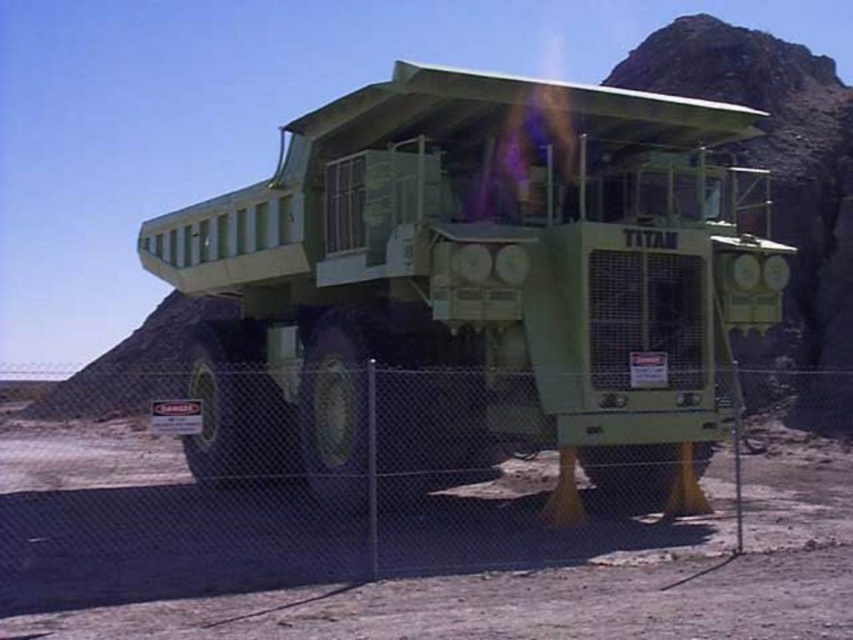
Between green matte titan truck at center and metal chain-link fence at lower center, which one is positioned higher?

Positioned higher is green matte titan truck at center.

Is green matte titan truck at center further to camera compared to metal chain-link fence at lower center?

Yes, it is behind metal chain-link fence at lower center.

Does point (253, 336) come farther from viewer compared to point (115, 593)?

Yes, point (253, 336) is farther from viewer.

The width and height of the screenshot is (853, 640). What are the coordinates of `green matte titan truck at center` in the screenshot? It's located at (473, 285).